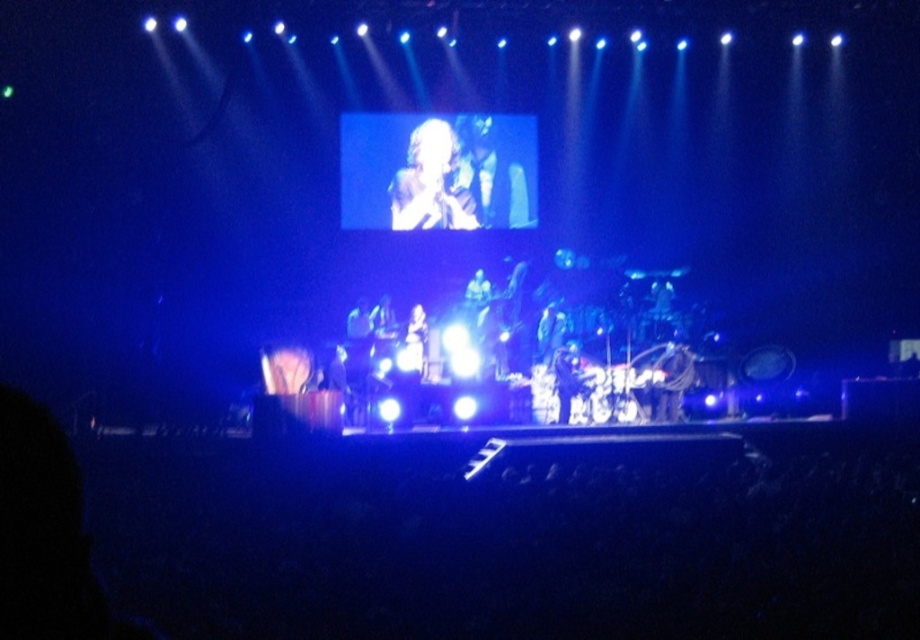
Who is higher up, shiny black guitar at center or blonde hair at center?

shiny black guitar at center is higher up.

Is shiny black guitar at center bigger than blonde hair at center?

Yes.

Is point (525, 173) closer to camera compared to point (444, 198)?

No, (525, 173) is further to viewer.

You are a GUI agent. You are given a task and a screenshot of the screen. Output one action in this format:
    pyautogui.click(x=<x>, y=<y>)
    Task: Click on the shiny black guitar at center
    Image resolution: width=920 pixels, height=640 pixels.
    Given the screenshot: What is the action you would take?
    pyautogui.click(x=497, y=168)

From the picture: Between blonde hair at center and matte black microphone at center, which one has more height?

Standing taller between the two is blonde hair at center.

Can you confirm if blonde hair at center is shorter than matte black microphone at center?

No, blonde hair at center is not shorter than matte black microphone at center.

Between point (444, 220) and point (361, 317), which one is positioned in front?

Positioned in front is point (361, 317).

Find the location of a particular element. The width and height of the screenshot is (920, 640). blonde hair at center is located at coordinates (432, 182).

Is point (512, 216) closer to viewer compared to point (351, 323)?

No, it is behind (351, 323).

What do you see at coordinates (497, 168) in the screenshot? I see `shiny black guitar at center` at bounding box center [497, 168].

Identify the location of shiny black guitar at center. This screenshot has height=640, width=920. (497, 168).